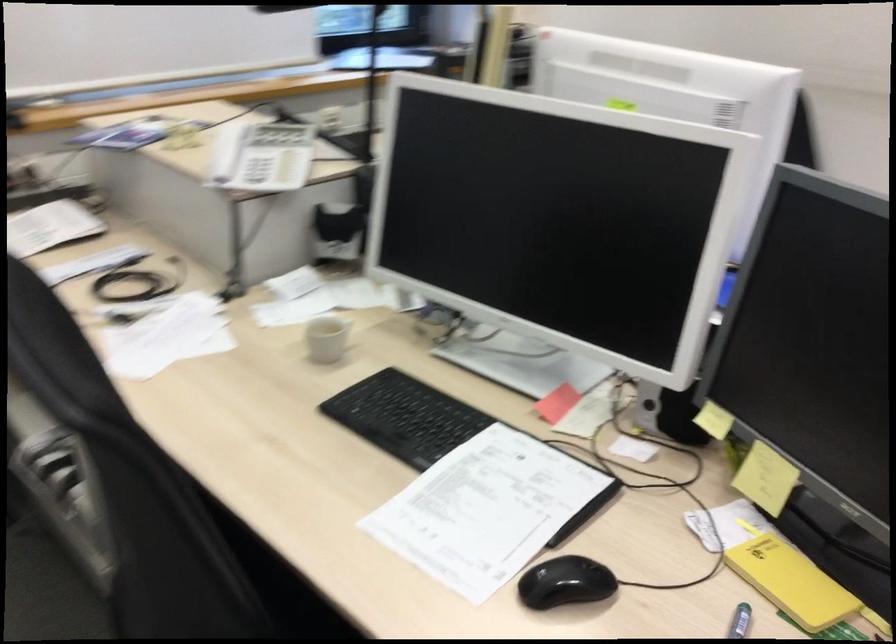
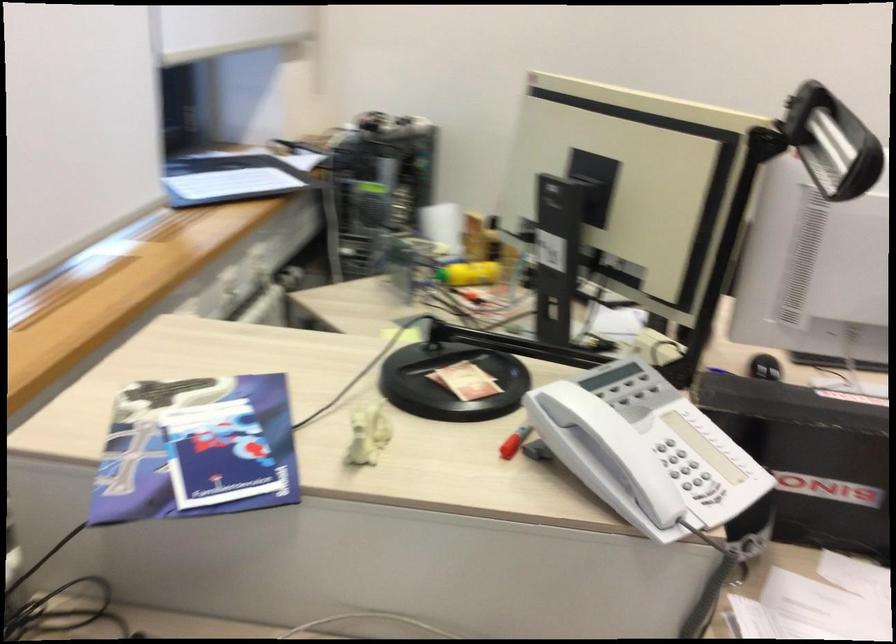
Locate, in the second image, the point that corresponds to (x=228, y=156) in the first image.

(513, 442)